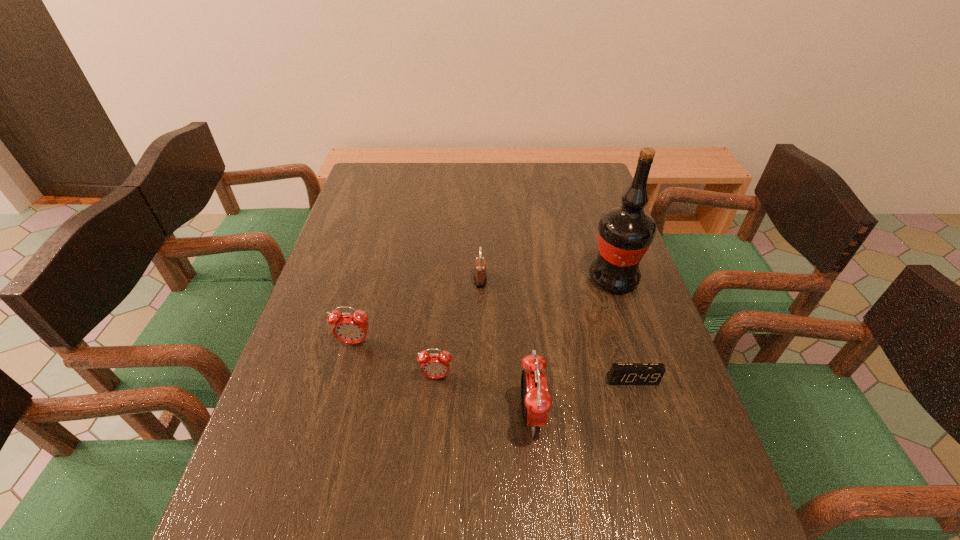
What are the coordinates of `free space located 0.320m on the face of the fourth nearest object` in the screenshot? It's located at (317, 485).

At what (x,y) coordinates should I click in order to perform the action: click on vacant region located on the face of the third alarm clock from right to left. Please return your answer as a coordinate pair (x, y). This screenshot has width=960, height=540. Looking at the image, I should click on (428, 477).

Image resolution: width=960 pixels, height=540 pixels. I want to click on vacant area situated on the face of the third object from right to left, so click(x=581, y=416).

Where is `vacant point located on the right of the padlock`? vacant point located on the right of the padlock is located at coordinates (569, 280).

This screenshot has width=960, height=540. I want to click on free space located 0.140m on the front-facing side of the shortest alarm clock, so click(x=652, y=446).

Locate an element on the screen. vacant space located on the back of the wine bottle is located at coordinates (591, 211).

The image size is (960, 540). What are the coordinates of `object at the left edge` in the screenshot? It's located at (351, 328).

At what (x,y) coordinates should I click in order to perform the action: click on alarm clock at the right edge. Please return your answer as a coordinate pair (x, y). The width and height of the screenshot is (960, 540). Looking at the image, I should click on (620, 373).

Where is `wine bottle that is at the right edge`? wine bottle that is at the right edge is located at coordinates (625, 232).

I want to click on free location at the far edge of the desktop, so click(x=447, y=192).